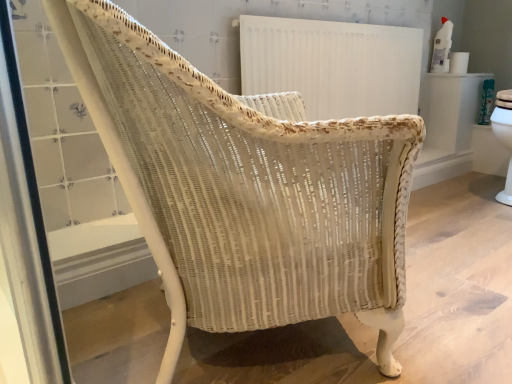
Identify the location of white paper towel at upper right. (458, 62).

What do you see at coordinates (458, 62) in the screenshot?
I see `white paper towel at upper right` at bounding box center [458, 62].

Where is `white textured radiator at upper center`? The width and height of the screenshot is (512, 384). white textured radiator at upper center is located at coordinates (333, 65).

The image size is (512, 384). What do you see at coordinates (333, 65) in the screenshot? I see `white textured radiator at upper center` at bounding box center [333, 65].

This screenshot has width=512, height=384. Identify the location of white paper towel at upper right. (458, 62).

Can you confirm if white textured radiator at upper center is positioned to the left of white paper towel at upper right?

Yes, white textured radiator at upper center is to the left of white paper towel at upper right.

Relative to white paper towel at upper right, is white textured radiator at upper center in front or behind?

Visually, white textured radiator at upper center is located in front of white paper towel at upper right.

Between point (349, 82) and point (450, 56), which one is positioned behind?

The point (450, 56) is farther from the camera.

From the image's perspective, is white textured radiator at upper center above white paper towel at upper right?

No, from the image's perspective, white textured radiator at upper center is not above white paper towel at upper right.

From a real-world perspective, is white textured radiator at upper center on top of white paper towel at upper right?

No.

Looking at this image, considering the relative sizes of white textured radiator at upper center and white paper towel at upper right in the image provided, is white textured radiator at upper center wider than white paper towel at upper right?

No, white textured radiator at upper center is not wider than white paper towel at upper right.

Is white textured radiator at upper center taller or shorter than white paper towel at upper right?

Considering their sizes, white textured radiator at upper center has more height than white paper towel at upper right.

Considering the sizes of white textured radiator at upper center and white paper towel at upper right in the image, is white textured radiator at upper center bigger or smaller than white paper towel at upper right?

white textured radiator at upper center is bigger than white paper towel at upper right.

Would you say white textured radiator at upper center is outside white paper towel at upper right?

Indeed, white textured radiator at upper center is completely outside white paper towel at upper right.

Consider the image. Is white textured radiator at upper center next to white paper towel at upper right and touching it?

No, white textured radiator at upper center is not next to white paper towel at upper right.

Is white textured radiator at upper center positioned with its back to white paper towel at upper right?

No, white textured radiator at upper center's orientation is not away from white paper towel at upper right.

How many degrees apart are the facing directions of white textured radiator at upper center and white paper towel at upper right?

The angular difference between white textured radiator at upper center and white paper towel at upper right is 0.411 degrees.

The height and width of the screenshot is (384, 512). Find the location of `radiator below the white paper towel at upper right (from the image's perspective)`. radiator below the white paper towel at upper right (from the image's perspective) is located at coordinates (333, 65).

Can you confirm if white paper towel at upper right is positioned to the left of white textured radiator at upper center?

Incorrect, white paper towel at upper right is not on the left side of white textured radiator at upper center.

Which object is further away from the camera, white paper towel at upper right or white textured radiator at upper center?

white paper towel at upper right is further from the camera.

Between point (456, 66) and point (308, 49), which one is positioned behind?

Positioned behind is point (456, 66).

From the image's perspective, is white paper towel at upper right above or below white textured radiator at upper center?

white paper towel at upper right is above white textured radiator at upper center.

From a real-world perspective, is white paper towel at upper right physically below white textured radiator at upper center?

No, from a real-world perspective, white paper towel at upper right is not under white textured radiator at upper center.

Which of these two, white paper towel at upper right or white textured radiator at upper center, is thinner?

Thinner between the two is white textured radiator at upper center.

Considering the relative sizes of white paper towel at upper right and white textured radiator at upper center in the image provided, is white paper towel at upper right shorter than white textured radiator at upper center?

Indeed, white paper towel at upper right has a lesser height compared to white textured radiator at upper center.

Considering the sizes of white paper towel at upper right and white textured radiator at upper center in the image, is white paper towel at upper right bigger or smaller than white textured radiator at upper center?

In the image, white paper towel at upper right appears to be smaller than white textured radiator at upper center.

Can we say white paper towel at upper right lies outside white textured radiator at upper center?

white paper towel at upper right is positioned outside white textured radiator at upper center.

Based on the photo, is white paper towel at upper right far away from white textured radiator at upper center?

No, white paper towel at upper right is not far away from white textured radiator at upper center.

Does white paper towel at upper right turn towards white textured radiator at upper center?

No, white paper towel at upper right is not aimed at white textured radiator at upper center.

Can you tell me how much white paper towel at upper right and white textured radiator at upper center differ in facing direction?

0.411 degrees.

Where is `radiator below the white paper towel at upper right (from a real-world perspective)`? Image resolution: width=512 pixels, height=384 pixels. radiator below the white paper towel at upper right (from a real-world perspective) is located at coordinates (333, 65).

This screenshot has height=384, width=512. I want to click on radiator that is below the white paper towel at upper right (from the image's perspective), so click(x=333, y=65).

You are a GUI agent. You are given a task and a screenshot of the screen. Output one action in this format:
    pyautogui.click(x=<x>, y=<y>)
    Task: Click on the radiator on the left of white paper towel at upper right
    This screenshot has height=384, width=512.
    Given the screenshot: What is the action you would take?
    pyautogui.click(x=333, y=65)